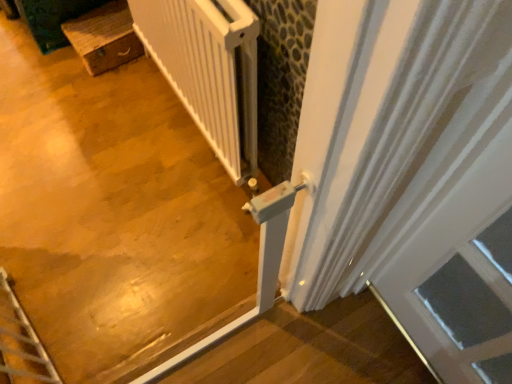
Find the location of a particular element. free space in front of white matte radiator at center is located at coordinates (148, 231).